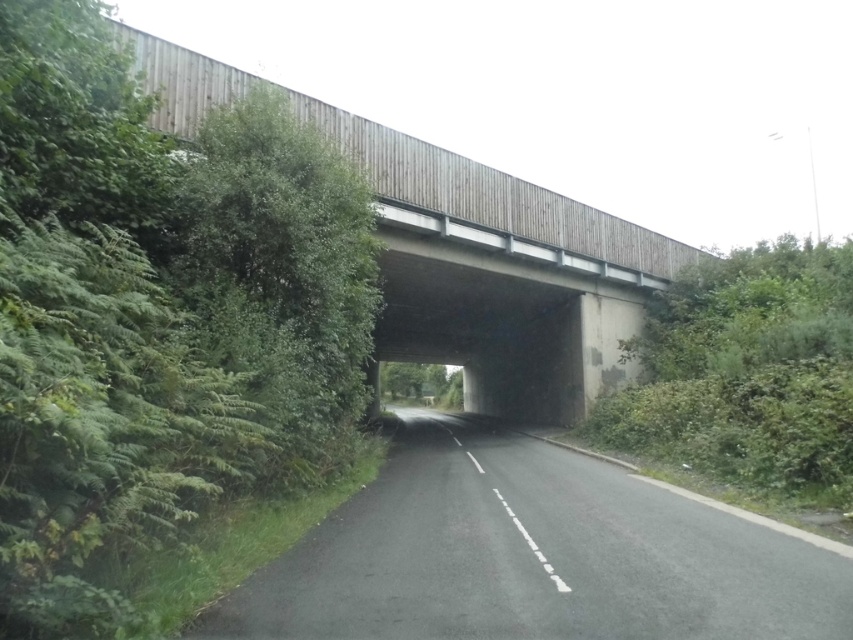
You are driving a car and see two points on the road ahead. The first point is at coordinate point(529, 568) and the second point is at point(421, 308). Which point is closer to your current position?

Point(421, 308) is closer to your current position because it is behind point(529, 568), which is further ahead.

You are driving a truck that is 3 meters wide. You need to cross the wooden bridge at center. The black asphalt road at center is under the bridge. Can your truck fit through the bridge without hitting the sides?

The black asphalt road at center is positioned on the left side of wooden bridge at center, which means the bridge spans over the road. Since the truck is 3 meters wide and the road is under the bridge, the truck can safely drive through the bridge as long as it stays within the road lanes. The bridge width should accommodate the road width, allowing the truck to pass without hitting the sides.